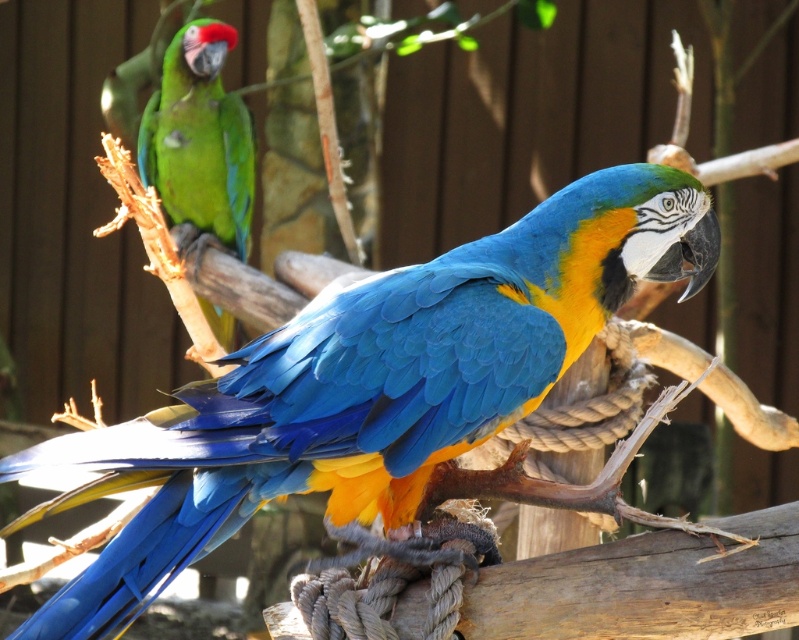
Is blue glossy parrot at center further to the viewer compared to green matte parrot at upper left?

No, it is not.

Can you confirm if blue glossy parrot at center is smaller than green matte parrot at upper left?

No.

Between point (420, 355) and point (245, 193), which one is positioned behind?

The point (245, 193) is more distant.

Locate an element on the screen. blue glossy parrot at center is located at coordinates (374, 388).